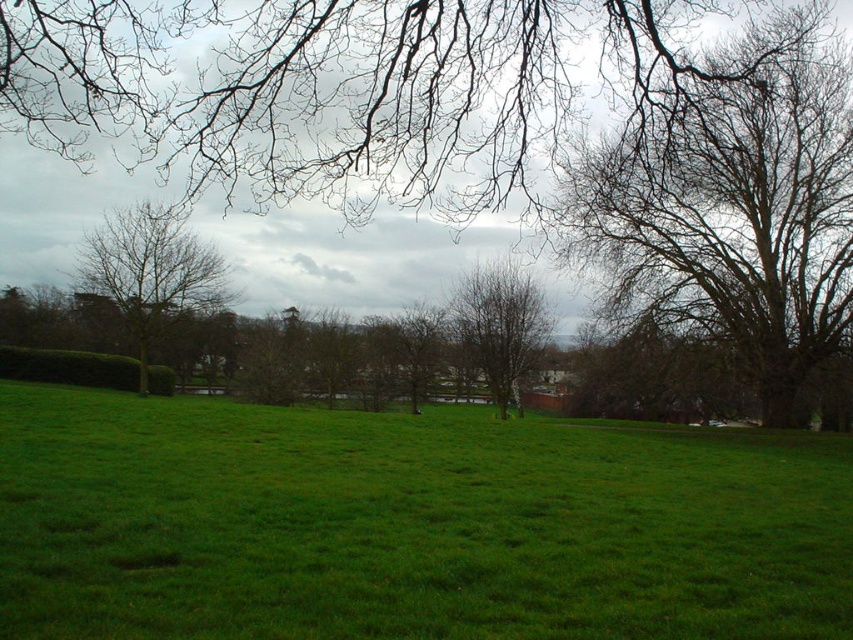
You are an artist sketching the scene and want to draw the relationship between the two sets of bare branches. According to the image, which direction should you place the bare branches at upper center relative to the bare branches at left?

The bare branches at upper center should be placed to the right of the bare branches at left.

You are standing in the middle of the grassy field and want to walk towards the bare branches at upper center located at point (337, 88). Which direction should you head?

You should head north because the bare branches at upper center are located at point (337, 88), which is in the northern direction from your current position in the middle of the grassy field.